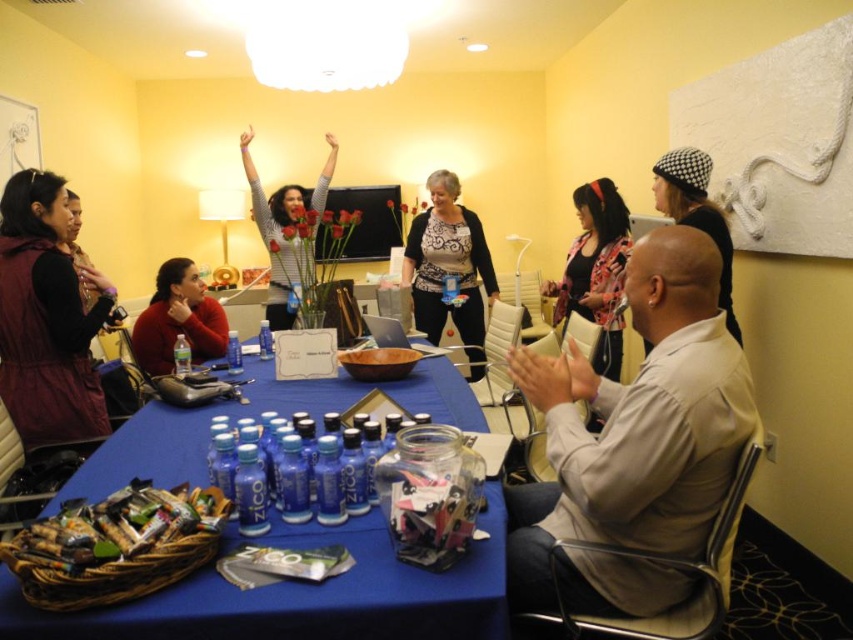
Question: Based on their relative distances, which object is nearer to the brown woven basket at lower left?

Choices:
 (A) matte red sweater at lower left
 (B) maroon textured vest at left
 (C) striped sweater at center

Answer: (B)

Question: Which point is closer to the camera?

Choices:
 (A) blue plastic bottles at center
 (B) black checkered hat at upper right
 (C) floral-patterned jacket at center

Answer: (A)

Question: Can you confirm if blue plastic bottles at center is bigger than brown woven basket at lower left?

Choices:
 (A) no
 (B) yes

Answer: (B)

Question: Does blue plastic bottles at center have a smaller size compared to black lace cardigan at center?

Choices:
 (A) no
 (B) yes

Answer: (B)

Question: Is matte red sweater at lower left thinner than striped sweater at center?

Choices:
 (A) yes
 (B) no

Answer: (A)

Question: Estimate the real-world distances between objects in this image. Which object is farther from the blue plastic bottles at center?

Choices:
 (A) brown woven basket at lower left
 (B) blue matte bottle at center
 (C) matte red sweater at lower left
 (D) floral-patterned jacket at center

Answer: (D)